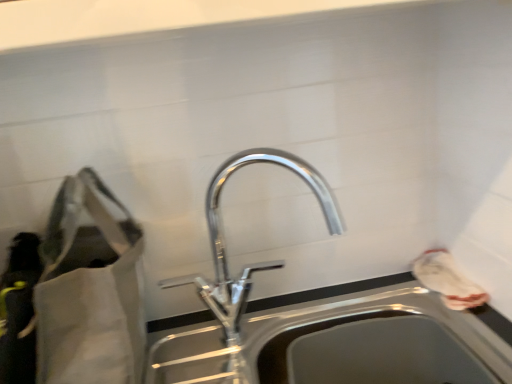
Question: From the image's perspective, is matte gray bag at left, positioned as the 2th bag in right-to-left order, beneath stainless steel sink at center?

Choices:
 (A) no
 (B) yes

Answer: (A)

Question: Considering the relative positions of matte gray bag at left, positioned as the first bag in left-to-right order, and stainless steel sink at center in the image provided, is matte gray bag at left, positioned as the first bag in left-to-right order, in front of stainless steel sink at center?

Choices:
 (A) no
 (B) yes

Answer: (B)

Question: Considering the relative sizes of matte gray bag at left, positioned as the 2th bag in right-to-left order, and stainless steel sink at center in the image provided, is matte gray bag at left, positioned as the 2th bag in right-to-left order, thinner than stainless steel sink at center?

Choices:
 (A) no
 (B) yes

Answer: (A)

Question: Does matte gray bag at left, positioned as the 2th bag in right-to-left order, appear on the right side of stainless steel sink at center?

Choices:
 (A) no
 (B) yes

Answer: (A)

Question: Is matte gray bag at left, positioned as the first bag in left-to-right order, placed right next to stainless steel sink at center?

Choices:
 (A) no
 (B) yes

Answer: (A)

Question: In terms of height, does stainless steel sink at center look taller or shorter compared to white fabric bag at right, arranged as the 2th bag when viewed from the left?

Choices:
 (A) short
 (B) tall

Answer: (B)

Question: Does point (309, 311) appear closer or farther from the camera than point (452, 296)?

Choices:
 (A) farther
 (B) closer

Answer: (A)

Question: Would you say stainless steel sink at center is inside or outside white fabric bag at right, the 1th bag positioned from the right?

Choices:
 (A) outside
 (B) inside

Answer: (A)

Question: Looking at the image, does stainless steel sink at center seem bigger or smaller compared to white fabric bag at right, arranged as the 2th bag when viewed from the left?

Choices:
 (A) big
 (B) small

Answer: (A)

Question: Would you say polished chrome tap at center is to the left or to the right of white fabric bag at right, arranged as the 2th bag when viewed from the left, in the picture?

Choices:
 (A) left
 (B) right

Answer: (A)

Question: Looking at their shapes, would you say polished chrome tap at center is wider or thinner than white fabric bag at right, arranged as the 2th bag when viewed from the left?

Choices:
 (A) thin
 (B) wide

Answer: (B)

Question: Considering the positions of point (333, 228) and point (452, 307), is point (333, 228) closer or farther from the camera than point (452, 307)?

Choices:
 (A) closer
 (B) farther

Answer: (B)

Question: Based on their sizes in the image, would you say polished chrome tap at center is bigger or smaller than white fabric bag at right, arranged as the 2th bag when viewed from the left?

Choices:
 (A) small
 (B) big

Answer: (B)

Question: From a real-world perspective, relative to polished chrome tap at center, is white fabric bag at right, arranged as the 2th bag when viewed from the left, vertically above or below?

Choices:
 (A) below
 (B) above

Answer: (A)

Question: Considering their positions, is white fabric bag at right, arranged as the 2th bag when viewed from the left, located in front of or behind polished chrome tap at center?

Choices:
 (A) behind
 (B) front

Answer: (A)